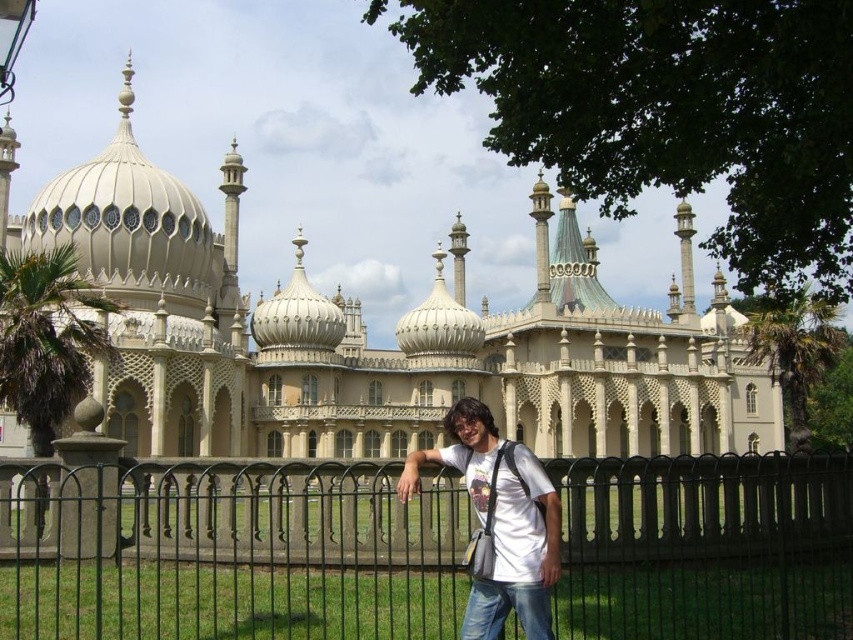
You are standing in front of the grand palace and want to determine which of the two points, point (170, 253) or point (491, 515), is closer to you. Based on the scene, which point is nearer?

Point (170, 253) is closer to you because it is further to the viewer than point (491, 515).